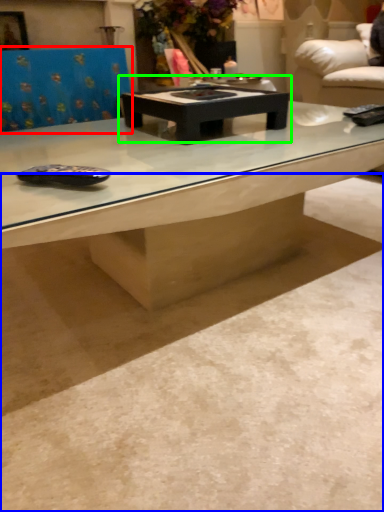
Question: Which object is the farthest from swivel chair (highlighted by a red box)? Choose among these: concrete (highlighted by a blue box) or coffee table (highlighted by a green box).

Choices:
 (A) concrete
 (B) coffee table

Answer: (A)